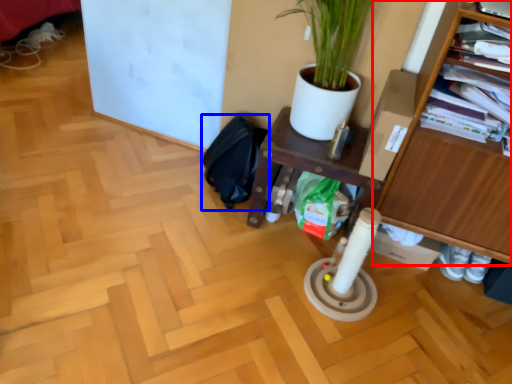
Question: Which point is further to the camera, furniture (highlighted by a red box) or swivel chair (highlighted by a blue box)?

Choices:
 (A) furniture
 (B) swivel chair

Answer: (B)